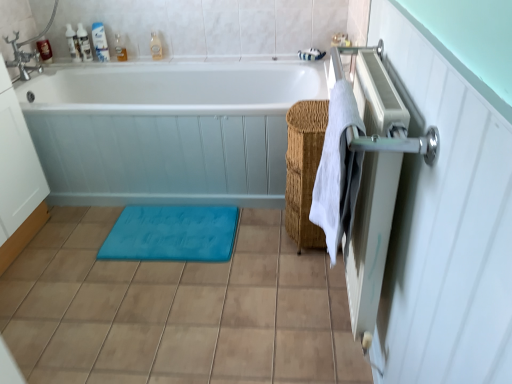
Question: Is translucent plastic bottle at upper center, arranged as the first toiletry when viewed from the right, shorter than translucent plastic bottles at upper left, arranged as the 5th toiletry when viewed from the right?

Choices:
 (A) yes
 (B) no

Answer: (A)

Question: From the image's perspective, does translucent plastic bottle at upper center, which is the sixth toiletry in left-to-right order, appear lower than translucent plastic bottles at upper left, the second toiletry viewed from the left?

Choices:
 (A) yes
 (B) no

Answer: (A)

Question: Does translucent plastic bottle at upper center, which is the sixth toiletry in left-to-right order, have a larger size compared to translucent plastic bottles at upper left, arranged as the 5th toiletry when viewed from the right?

Choices:
 (A) no
 (B) yes

Answer: (A)

Question: Is translucent plastic bottles at upper left, arranged as the 5th toiletry when viewed from the right, at the back of translucent plastic bottle at upper center, arranged as the first toiletry when viewed from the right?

Choices:
 (A) yes
 (B) no

Answer: (B)

Question: Is translucent plastic bottle at upper center, which is the sixth toiletry in left-to-right order, aimed at translucent plastic bottles at upper left, the second toiletry viewed from the left?

Choices:
 (A) no
 (B) yes

Answer: (A)

Question: Is translucent plastic bottles at upper left, the second toiletry viewed from the left, wider or thinner than blue rubber bath mat at center?

Choices:
 (A) wide
 (B) thin

Answer: (B)

Question: Considering the positions of translucent plastic bottles at upper left, the second toiletry viewed from the left, and blue rubber bath mat at center in the image, is translucent plastic bottles at upper left, the second toiletry viewed from the left, taller or shorter than blue rubber bath mat at center?

Choices:
 (A) short
 (B) tall

Answer: (B)

Question: From a real-world perspective, is translucent plastic bottles at upper left, arranged as the 5th toiletry when viewed from the right, positioned above or below blue rubber bath mat at center?

Choices:
 (A) below
 (B) above

Answer: (B)

Question: Do you think translucent plastic bottles at upper left, arranged as the 5th toiletry when viewed from the right, is within blue rubber bath mat at center, or outside of it?

Choices:
 (A) inside
 (B) outside

Answer: (B)

Question: Based on their positions, is translucent plastic bottles at upper left, the second toiletry viewed from the left, located to the left or right of brown matte tile at lower center?

Choices:
 (A) left
 (B) right

Answer: (A)

Question: Considering the positions of translucent plastic bottles at upper left, the second toiletry viewed from the left, and brown matte tile at lower center in the image, is translucent plastic bottles at upper left, the second toiletry viewed from the left, bigger or smaller than brown matte tile at lower center?

Choices:
 (A) small
 (B) big

Answer: (A)

Question: Considering the positions of translucent plastic bottles at upper left, arranged as the 5th toiletry when viewed from the right, and brown matte tile at lower center in the image, is translucent plastic bottles at upper left, arranged as the 5th toiletry when viewed from the right, wider or thinner than brown matte tile at lower center?

Choices:
 (A) thin
 (B) wide

Answer: (A)

Question: From the image's perspective, is translucent plastic bottles at upper left, arranged as the 5th toiletry when viewed from the right, located above or below brown matte tile at lower center?

Choices:
 (A) below
 (B) above

Answer: (B)

Question: From a real-world perspective, is white glossy bathtub at center above or below white glossy bottle at upper left, acting as the third toiletry starting from the right?

Choices:
 (A) below
 (B) above

Answer: (A)

Question: From the image's perspective, is white glossy bathtub at center above or below white glossy bottle at upper left, the fourth toiletry viewed from the left?

Choices:
 (A) above
 (B) below

Answer: (B)